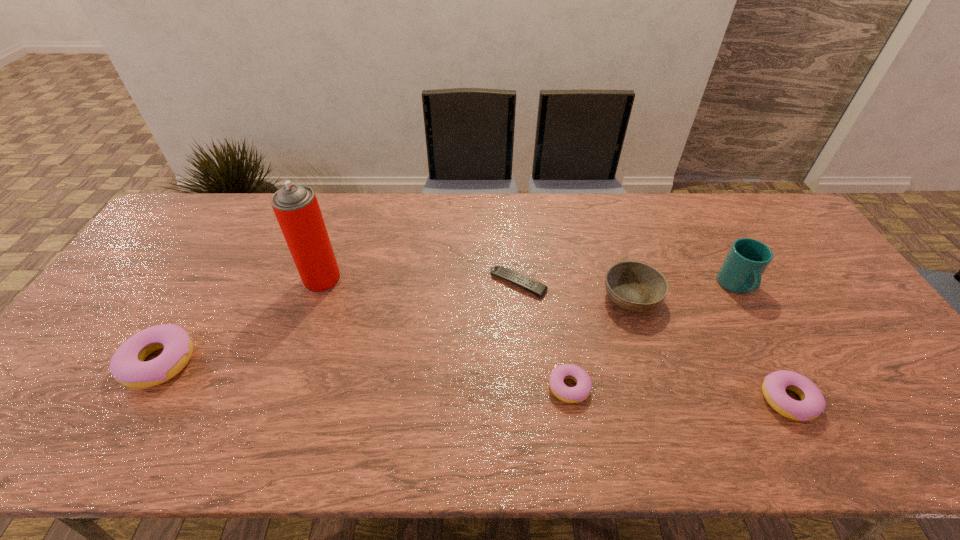
Locate an element on the screen. the leftmost object is located at coordinates (127, 366).

Where is `the leftmost doughnut`? This screenshot has width=960, height=540. the leftmost doughnut is located at coordinates (127, 366).

Locate an element on the screen. The width and height of the screenshot is (960, 540). the sixth tallest object is located at coordinates (581, 391).

Identify the location of the second doughnut from right to left. pos(581,391).

The width and height of the screenshot is (960, 540). What are the coordinates of `the rightmost doughnut` in the screenshot? It's located at (812, 404).

Where is `the third shortest object`? The width and height of the screenshot is (960, 540). the third shortest object is located at coordinates (812, 404).

You are a GUI agent. You are given a task and a screenshot of the screen. Output one action in this format:
    pyautogui.click(x=<x>, y=<y>)
    Task: Click on the sixth shortest object
    Image resolution: width=960 pixels, height=540 pixels.
    Given the screenshot: What is the action you would take?
    point(741,271)

Find the location of a particular element. The image size is (960, 540). remote control is located at coordinates (525, 282).

At what (x,y) coordinates should I click in order to perform the action: click on the third object from right to left. Please return your answer as a coordinate pair (x, y). Looking at the image, I should click on (634, 286).

This screenshot has height=540, width=960. I want to click on the tallest object, so click(296, 207).